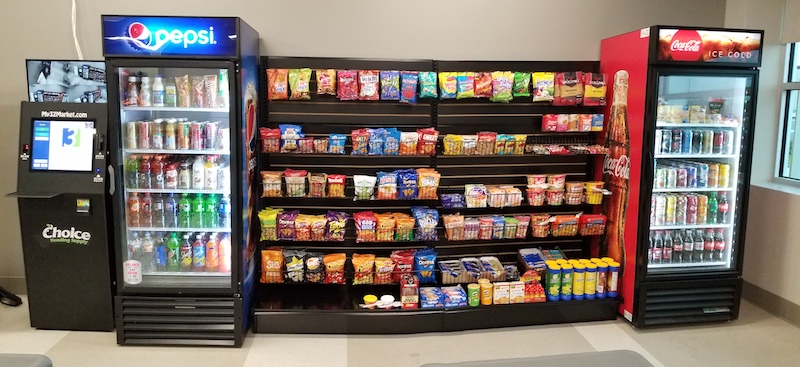
Locate an element on the screen. The height and width of the screenshot is (367, 800). window is located at coordinates (792, 157).